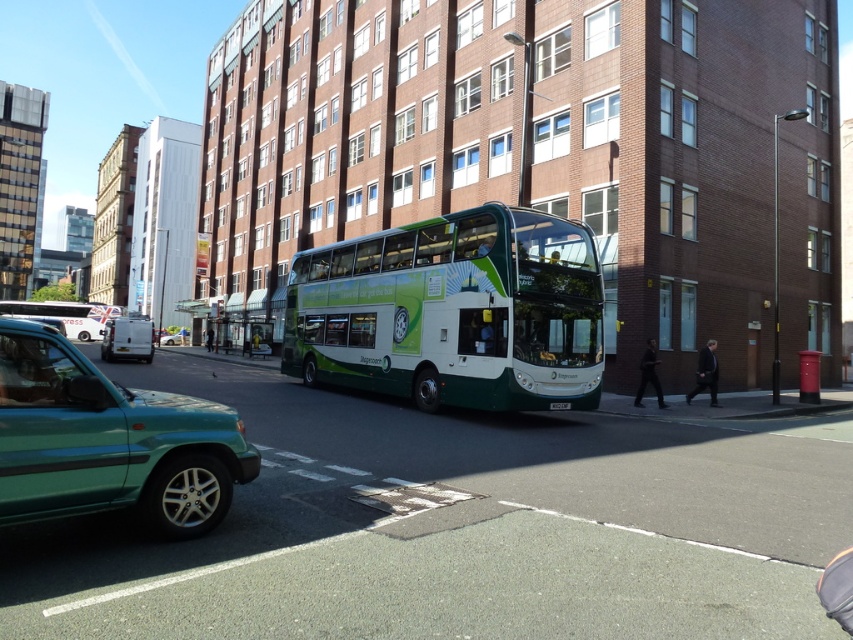
Between green matte/deck bus at center and white matte van at left, which one appears on the left side from the viewer's perspective?

white matte van at left is more to the left.

Is point (419, 387) less distant than point (148, 326)?

Yes, it is.

Locate an element on the screen. The height and width of the screenshot is (640, 853). green matte/deck bus at center is located at coordinates (453, 310).

Is green matte/deck bus at center thinner than white plastic license plate at center?

In fact, green matte/deck bus at center might be wider than white plastic license plate at center.

Can you confirm if green matte/deck bus at center is taller than white plastic license plate at center?

Yes.

Identify the location of green matte/deck bus at center. The width and height of the screenshot is (853, 640). (453, 310).

Image resolution: width=853 pixels, height=640 pixels. In order to click on green matte/deck bus at center in this screenshot , I will do `click(453, 310)`.

Can you confirm if white matte van at left is positioned to the right of white plastic license plate at center?

Incorrect, white matte van at left is not on the right side of white plastic license plate at center.

Can you confirm if white matte van at left is thinner than white plastic license plate at center?

No, white matte van at left is not thinner than white plastic license plate at center.

Is point (132, 333) farther from viewer compared to point (570, 404)?

Yes, it is behind point (570, 404).

At what (x,y) coordinates should I click in order to perform the action: click on white matte van at left. Please return your answer as a coordinate pair (x, y). Looking at the image, I should click on (126, 339).